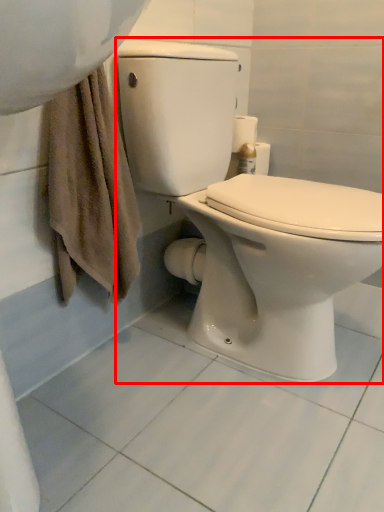
Question: From the image's perspective, considering the relative positions of toilet (annotated by the red box) and toilet paper in the image provided, where is toilet (annotated by the red box) located with respect to the staircase?

Choices:
 (A) below
 (B) above

Answer: (A)